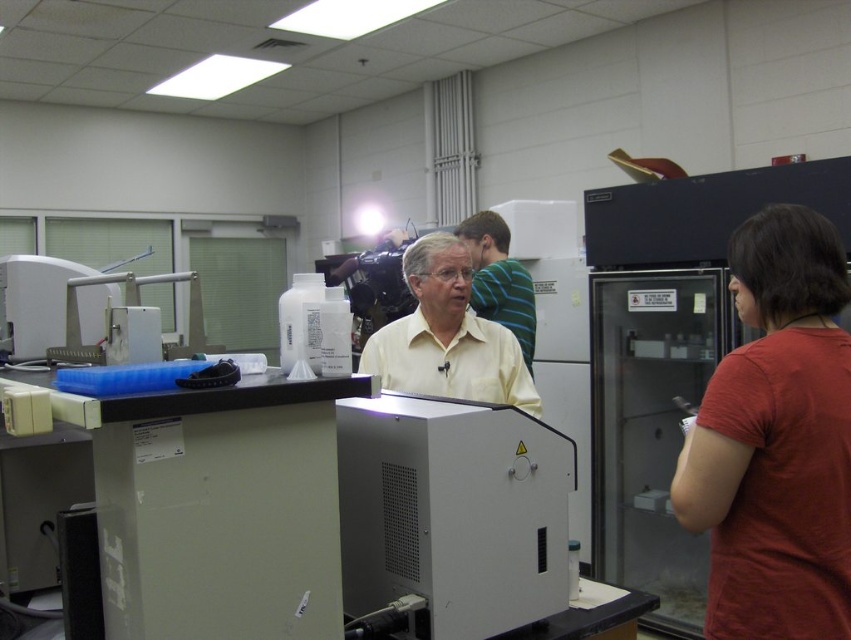
You are taking a photo of the laboratory setup. You need to focus on both the point at (694, 477) and the point at (461, 348). Which point should you focus on first to ensure both are in focus?

You should focus on point (694, 477) first because it is closer to the camera than point (461, 348). By focusing on the closer point, the farther point will also be within the depth of field.

You are standing in the laboratory and need to locate the red cotton shirt at right. According to the coordinates provided, where would you find it in the image?

The red cotton shirt at right is located at the 2D coordinates point (775, 440) in the image.

In the laboratory scene, there is a white plastic machine at center and a light yellow shirt at center. Which object is positioned lower in the image?

The white plastic machine at center is located below the light yellow shirt at center, so it is positioned lower in the image.